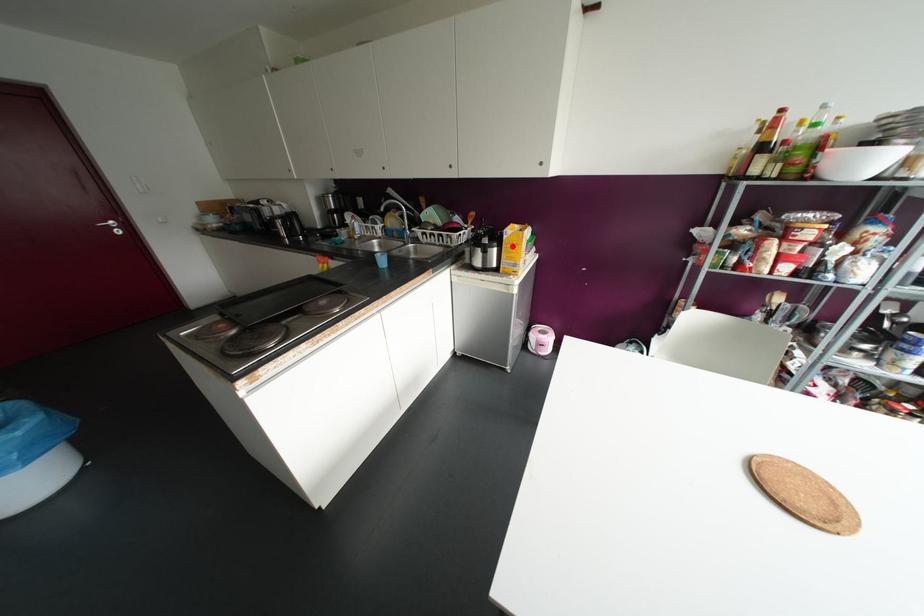
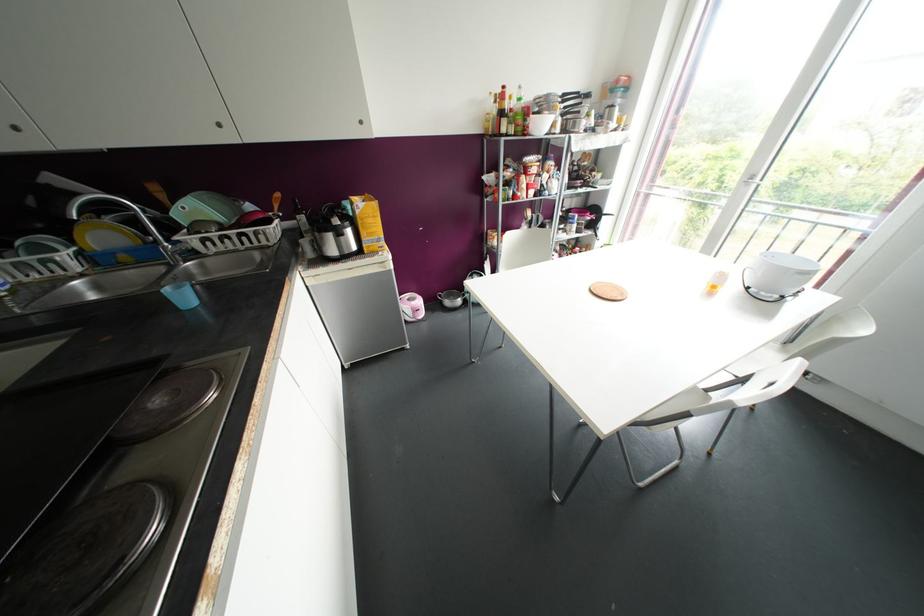
Where in the second image is the point corresponding to the highlighted location from the first image?

(370, 220)